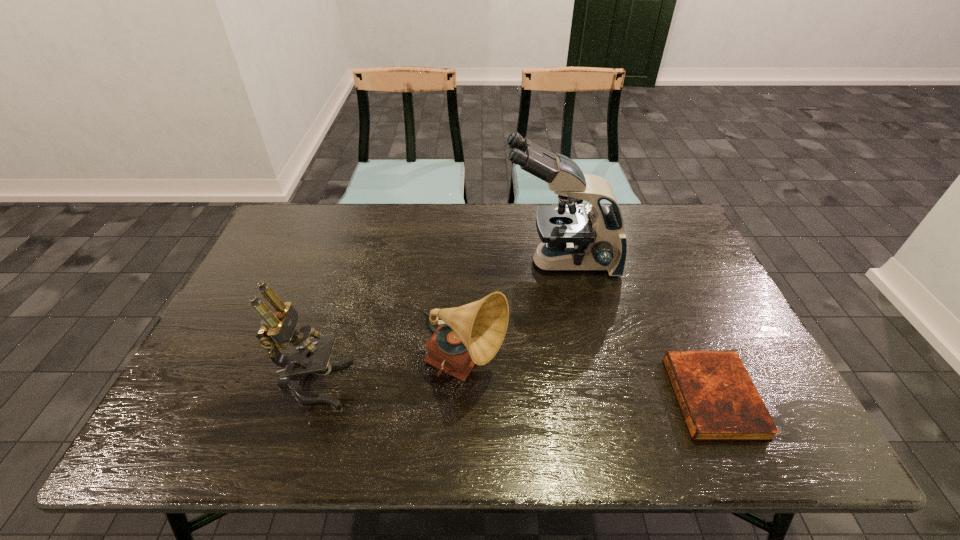
Locate an element on the screen. This screenshot has height=540, width=960. the tallest object is located at coordinates (571, 239).

Identify the location of the farthest object. (571, 239).

Where is `the shorter microscope`? the shorter microscope is located at coordinates (310, 355).

Find the location of `the left microscope`. the left microscope is located at coordinates (310, 355).

The width and height of the screenshot is (960, 540). Identify the location of the second object from left to right. (471, 334).

Locate an element on the screen. The height and width of the screenshot is (540, 960). Bible is located at coordinates (719, 401).

Find the location of a particular element. This screenshot has width=960, height=540. the rightmost object is located at coordinates (719, 401).

Where is `blank area located through the eyepieces of the tallest object`? blank area located through the eyepieces of the tallest object is located at coordinates (440, 262).

The image size is (960, 540). What are the coordinates of `free space located 0.360m through the eyepieces of the tallest object` in the screenshot? It's located at (384, 262).

Where is `vacant space located through the eyepieces of the tallest object`? Image resolution: width=960 pixels, height=540 pixels. vacant space located through the eyepieces of the tallest object is located at coordinates (479, 262).